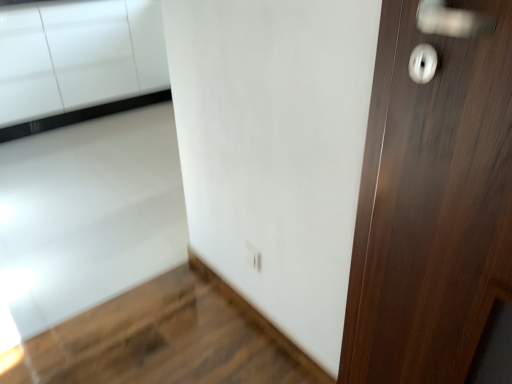
The height and width of the screenshot is (384, 512). Describe the element at coordinates (432, 205) in the screenshot. I see `dark wood door at right` at that location.

Describe the element at coordinates (253, 257) in the screenshot. I see `white glossy electric outlet at lower center` at that location.

Describe the element at coordinates (78, 62) in the screenshot. This screenshot has width=512, height=384. I see `white glossy cabinetry at lower left` at that location.

Find the location of a particular element. The width and height of the screenshot is (512, 384). dark wood door at right is located at coordinates (432, 205).

From their relative heights in the image, would you say white glossy electric outlet at lower center is taller or shorter than dark wood door at right?

Considering their sizes, white glossy electric outlet at lower center has less height than dark wood door at right.

I want to click on door above the white glossy electric outlet at lower center (from a real-world perspective), so click(x=432, y=205).

In the scene shown: Is white glossy electric outlet at lower center positioned with its back to dark wood door at right?

No, white glossy electric outlet at lower center is not facing the opposite direction of dark wood door at right.

Where is `cabinetry behind the dark wood door at right`? The width and height of the screenshot is (512, 384). cabinetry behind the dark wood door at right is located at coordinates (78, 62).

Does white glossy cabinetry at lower left turn towards dark wood door at right?

Yes, white glossy cabinetry at lower left faces towards dark wood door at right.

Is point (15, 36) closer or farther from the camera than point (362, 346)?

Point (15, 36).

Considering the sizes of objects white glossy cabinetry at lower left and dark wood door at right in the image provided, who is shorter, white glossy cabinetry at lower left or dark wood door at right?

white glossy cabinetry at lower left.

Based on the photo, considering the relative sizes of white glossy cabinetry at lower left and white glossy electric outlet at lower center in the image provided, is white glossy cabinetry at lower left shorter than white glossy electric outlet at lower center?

No, white glossy cabinetry at lower left is not shorter than white glossy electric outlet at lower center.

Consider the image. Which object is wider, white glossy cabinetry at lower left or white glossy electric outlet at lower center?

With larger width is white glossy cabinetry at lower left.

From the image's perspective, which object appears higher, white glossy cabinetry at lower left or white glossy electric outlet at lower center?

From the image's view, white glossy cabinetry at lower left is above.

Between white glossy cabinetry at lower left and white glossy electric outlet at lower center, which one is positioned behind?

white glossy cabinetry at lower left is further away from the camera.

Relative to white glossy electric outlet at lower center, is dark wood door at right in front or behind?

dark wood door at right is in front of white glossy electric outlet at lower center.

Identify the location of electric outlet on the left of dark wood door at right. The height and width of the screenshot is (384, 512). (253, 257).

Are dark wood door at right and white glossy electric outlet at lower center making contact?

No, dark wood door at right is not making contact with white glossy electric outlet at lower center.

Does point (511, 106) appear closer or farther from the camera than point (248, 263)?

Point (511, 106).

Looking at this image, from the image's perspective, is white glossy electric outlet at lower center under white glossy cabinetry at lower left?

Correct, white glossy electric outlet at lower center appears lower than white glossy cabinetry at lower left in the image.

Find the location of a particular element. electric outlet beneath the white glossy cabinetry at lower left (from a real-world perspective) is located at coordinates (253, 257).

Could you tell me if white glossy electric outlet at lower center is turned towards white glossy cabinetry at lower left?

No, white glossy electric outlet at lower center does not turn towards white glossy cabinetry at lower left.

Considering the sizes of white glossy electric outlet at lower center and white glossy cabinetry at lower left in the image, is white glossy electric outlet at lower center wider or thinner than white glossy cabinetry at lower left?

white glossy electric outlet at lower center is thinner than white glossy cabinetry at lower left.

Considering the sizes of objects dark wood door at right and white glossy cabinetry at lower left in the image provided, who is shorter, dark wood door at right or white glossy cabinetry at lower left?

white glossy cabinetry at lower left is shorter.

Consider the image. How many degrees apart are the facing directions of dark wood door at right and white glossy cabinetry at lower left?

They differ by 89.5 degrees in their facing directions.

Would you say dark wood door at right is inside or outside white glossy cabinetry at lower left?

dark wood door at right is located beyond the bounds of white glossy cabinetry at lower left.

Is dark wood door at right wider or thinner than white glossy cabinetry at lower left?

Considering their sizes, dark wood door at right looks slimmer than white glossy cabinetry at lower left.

I want to click on door in front of the white glossy electric outlet at lower center, so click(x=432, y=205).

Locate an element on the screen. The image size is (512, 384). door that is above the white glossy cabinetry at lower left (from a real-world perspective) is located at coordinates (432, 205).

Which object lies further to the anchor point white glossy cabinetry at lower left, white glossy electric outlet at lower center or dark wood door at right?

Based on the image, dark wood door at right appears to be further to white glossy cabinetry at lower left.

Which object lies further to the anchor point dark wood door at right, white glossy electric outlet at lower center or white glossy cabinetry at lower left?

white glossy cabinetry at lower left is positioned further to the anchor dark wood door at right.

Estimate the real-world distances between objects in this image. Which object is further from white glossy electric outlet at lower center, dark wood door at right or white glossy cabinetry at lower left?

white glossy cabinetry at lower left lies further to white glossy electric outlet at lower center than the other object.

Which object lies further to the anchor point white glossy cabinetry at lower left, dark wood door at right or white glossy electric outlet at lower center?

Among the two, dark wood door at right is located further to white glossy cabinetry at lower left.

When comparing their distances from white glossy electric outlet at lower center, does white glossy cabinetry at lower left or dark wood door at right seem further?

white glossy cabinetry at lower left is positioned further to the anchor white glossy electric outlet at lower center.

From the image, which object appears to be nearer to dark wood door at right, white glossy cabinetry at lower left or white glossy electric outlet at lower center?

The object closer to dark wood door at right is white glossy electric outlet at lower center.

I want to click on electric outlet between dark wood door at right and white glossy cabinetry at lower left from front to back, so click(253, 257).